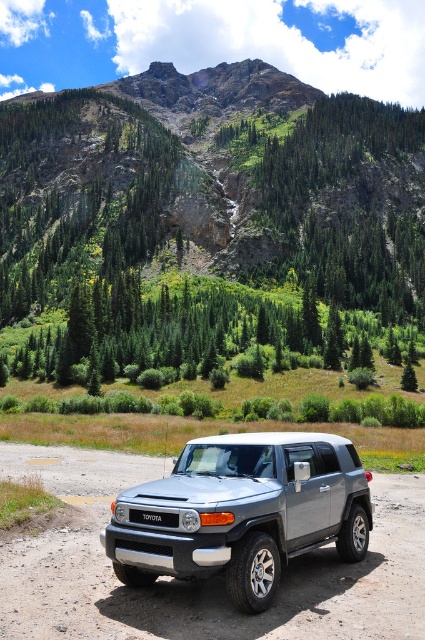
You are standing in front of the Toyota SUV on the dirt road. There are two points marked on the vehicle. The first point is at coordinate (195, 182) and the second at (119, 560). If you want to touch both points starting from the nearest one, which point should you reach first?

You should reach point (195, 182) first because it is closer to you than point (119, 560). Since it is further to the viewer, it means it is nearer in the 3D space from your perspective.

You are a hiker planning to take a photo of the satin silver suv at center while standing behind the green coniferous trees at upper center. Can you see the entire SUV without moving your position?

The green coniferous trees at upper center are located above the satin silver suv at center, so you can see the entire SUV without needing to move your position because the trees are positioned higher up and not blocking the lower area where the SUV is located.

You are a drone operator planning to take aerial shots of the Toyota SUV parked on a dirt road in a mountainous area. The green coniferous trees at upper center are located at coordinates point 0.325, 0.494. If you want to position your drone camera to capture the SUV without the trees blocking the view, which direction should you adjust the camera? Please provide your answer in terms of coordinates relative to the image frame where the origin is at the bottom left corner.

To avoid the green coniferous trees at upper center located at point (209, 208), you should adjust the camera position downward along the y axis to a coordinate with a lower y value than 0.494. This will lower the camera angle and keep the SUV in frame while moving the trees out of the way.